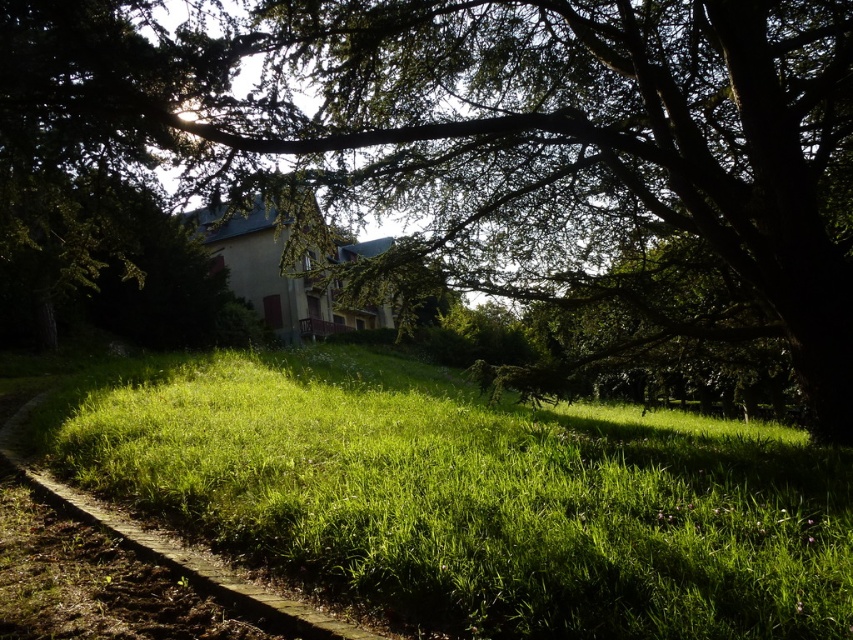
Question: From the image, what is the correct spatial relationship of green leafy tree at upper center in relation to green grassy at lower left?

Choices:
 (A) right
 (B) left

Answer: (B)

Question: Does green leafy tree at upper center have a lesser width compared to green grassy at lower left?

Choices:
 (A) no
 (B) yes

Answer: (B)

Question: Can you confirm if green leafy tree at upper center is smaller than green grassy at lower left?

Choices:
 (A) no
 (B) yes

Answer: (A)

Question: Which object appears farthest from the camera in this image?

Choices:
 (A) green grassy at lower left
 (B) green leafy tree at upper center

Answer: (B)